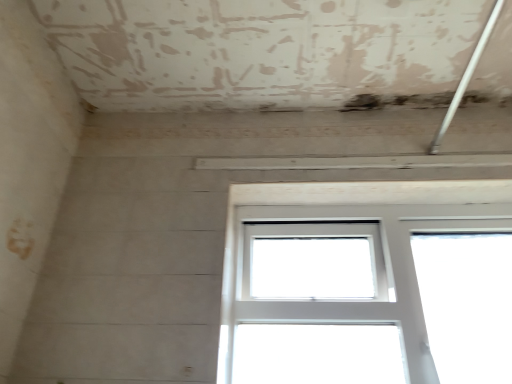
Question: Should I look upward or downward to see white plastic window at center?

Choices:
 (A) up
 (B) down

Answer: (B)